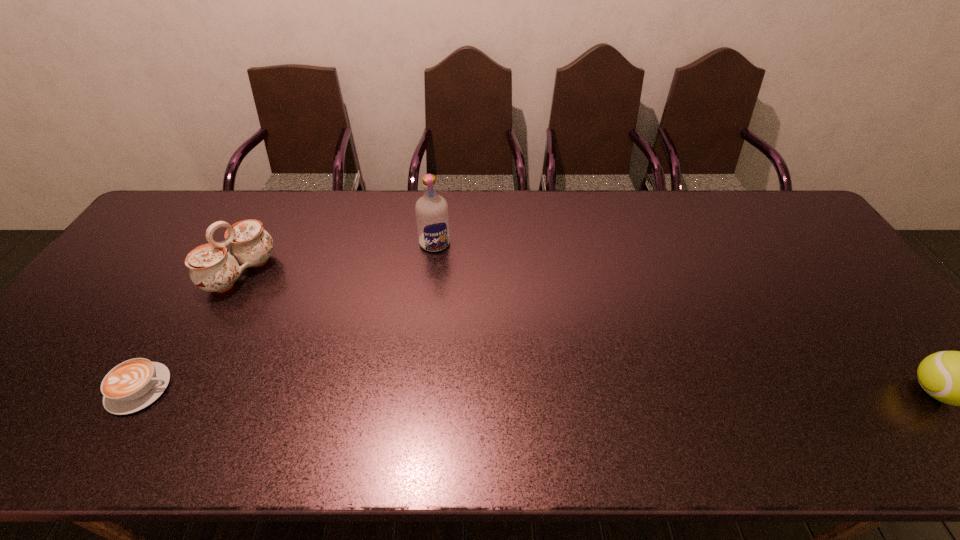
Locate an element on the screen. The width and height of the screenshot is (960, 540). vacant space located 0.270m on the label of the vodka is located at coordinates (459, 321).

This screenshot has height=540, width=960. What are the coordinates of `object at the far edge` in the screenshot? It's located at (431, 210).

At what (x,y) coordinates should I click in order to perform the action: click on object positioned at the near edge. Please return your answer as a coordinate pair (x, y). The width and height of the screenshot is (960, 540). Looking at the image, I should click on (134, 384).

Where is `vacant position at the far edge of the desktop`? The height and width of the screenshot is (540, 960). vacant position at the far edge of the desktop is located at coordinates (549, 211).

Locate an element on the screen. Image resolution: width=960 pixels, height=540 pixels. vacant space at the near edge of the desktop is located at coordinates (465, 395).

Image resolution: width=960 pixels, height=540 pixels. In the image, there is a desktop. Identify the location of vacant space at the right edge. (854, 287).

Find the location of a particular element. vacant space at the far left corner of the desktop is located at coordinates (163, 231).

The width and height of the screenshot is (960, 540). In order to click on vacant position at the near left corner of the desktop in this screenshot , I will do (x=60, y=404).

This screenshot has width=960, height=540. I want to click on free space at the far right corner, so click(807, 233).

Where is `vacant point located between the vodka and the shortest object`? This screenshot has width=960, height=540. vacant point located between the vodka and the shortest object is located at coordinates (287, 316).